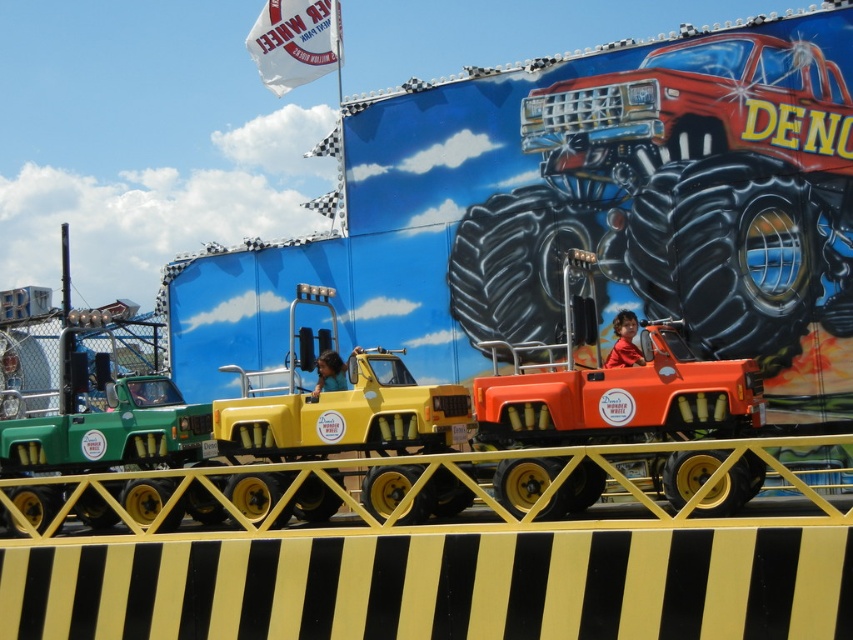
You are a carnival worker who needs to place a new 1.5 meter wide banner between the orange matte toy truck at center and the yellow matte truck at center. Can the banner fit between them without overlapping either truck?

The orange matte toy truck at center is 4.44 meters away from the yellow matte truck at center. Since the banner is only 1.5 meters wide, there is enough space between them to place the banner without overlapping either truck.

You are a child who wants to play with the orange matte toy truck at center and the yellow matte truck at center. Which truck do you think is wider?

The yellow matte truck at center is wider than the orange matte toy truck at center.